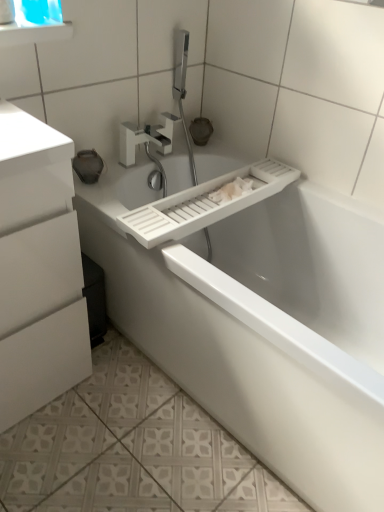
Question: Is transparent plastic window screen at upper left oriented away from white plastic sink at upper center?

Choices:
 (A) yes
 (B) no

Answer: (B)

Question: Is transparent plastic window screen at upper left at the left side of white plastic sink at upper center?

Choices:
 (A) yes
 (B) no

Answer: (A)

Question: Does transparent plastic window screen at upper left have a lesser height compared to white plastic sink at upper center?

Choices:
 (A) yes
 (B) no

Answer: (A)

Question: Is white plastic sink at upper center completely or partially inside transparent plastic window screen at upper left?

Choices:
 (A) yes
 (B) no

Answer: (B)

Question: Is transparent plastic window screen at upper left facing towards white plastic sink at upper center?

Choices:
 (A) yes
 (B) no

Answer: (B)

Question: Is transparent plastic window screen at upper left further to camera compared to white plastic sink at upper center?

Choices:
 (A) no
 (B) yes

Answer: (A)

Question: Is transparent plastic window screen at upper left oriented towards white matte tap at upper center?

Choices:
 (A) yes
 (B) no

Answer: (B)

Question: From a real-world perspective, is transparent plastic window screen at upper left below white matte tap at upper center?

Choices:
 (A) no
 (B) yes

Answer: (A)

Question: Is transparent plastic window screen at upper left positioned with its back to white matte tap at upper center?

Choices:
 (A) yes
 (B) no

Answer: (B)

Question: From the image's perspective, would you say transparent plastic window screen at upper left is shown under white matte tap at upper center?

Choices:
 (A) no
 (B) yes

Answer: (A)

Question: Can you confirm if transparent plastic window screen at upper left is smaller than white matte tap at upper center?

Choices:
 (A) yes
 (B) no

Answer: (A)

Question: Can you confirm if transparent plastic window screen at upper left is shorter than white matte tap at upper center?

Choices:
 (A) no
 (B) yes

Answer: (A)

Question: Is white plastic bathtub at center oriented away from white glossy cabinet at left?

Choices:
 (A) no
 (B) yes

Answer: (A)